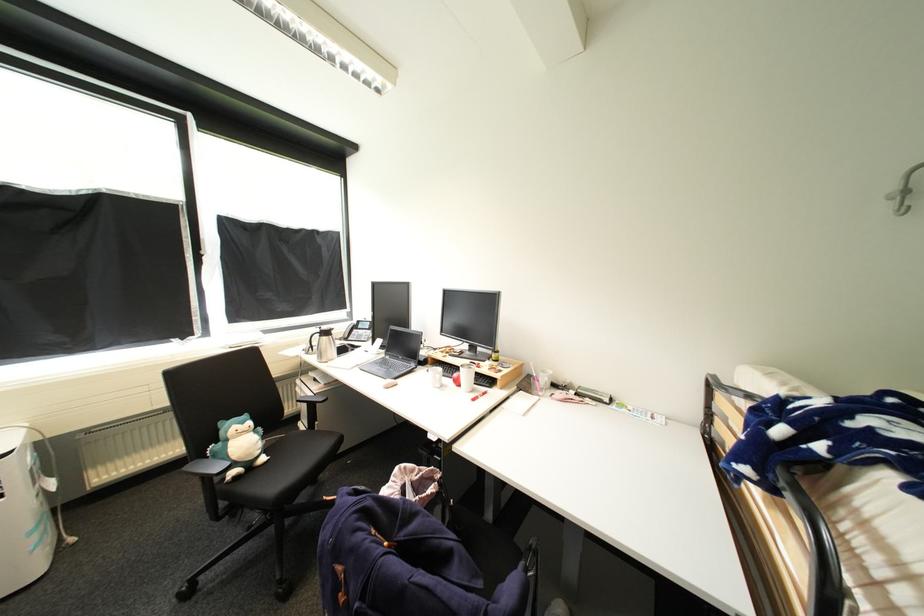
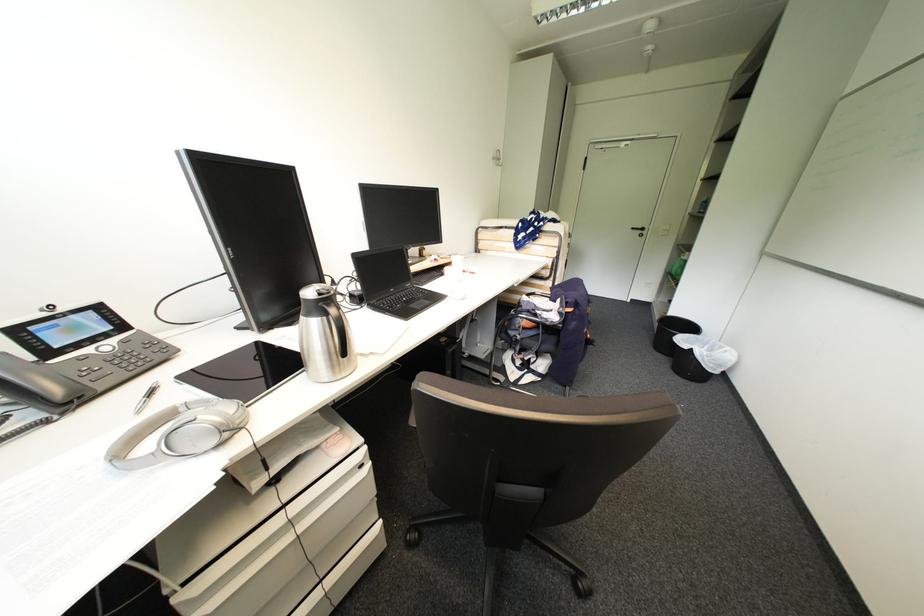
Locate, in the second image, the point that corresponds to point 322,379 in the first image.

(283, 480)